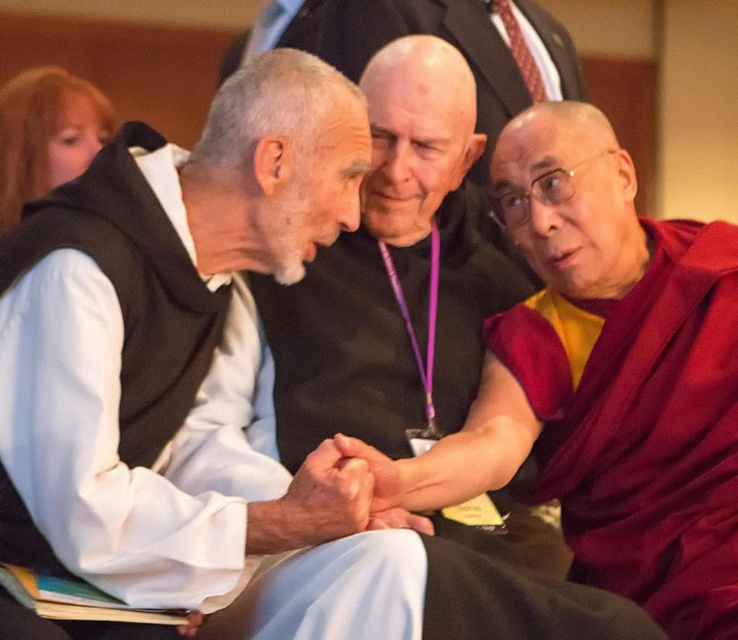
Question: Which point is closer to the camera?

Choices:
 (A) maroon silk robe at right
 (B) white clothed man at center
 (C) maroon silk robe at center

Answer: (A)

Question: Does maroon silk robe at center lie behind white clothed man at center?

Choices:
 (A) yes
 (B) no

Answer: (B)

Question: Based on their relative distances, which object is farther from the white clothed man at center?

Choices:
 (A) maroon silk robe at right
 (B) maroon silk robe at center

Answer: (A)

Question: Is maroon silk robe at center thinner than maroon silk robe at right?

Choices:
 (A) no
 (B) yes

Answer: (A)

Question: Estimate the real-world distances between objects in this image. Which object is closer to the maroon silk robe at center?

Choices:
 (A) maroon silk robe at right
 (B) white clothed man at center

Answer: (A)

Question: Is maroon silk robe at center behind maroon silk robe at right?

Choices:
 (A) no
 (B) yes

Answer: (B)